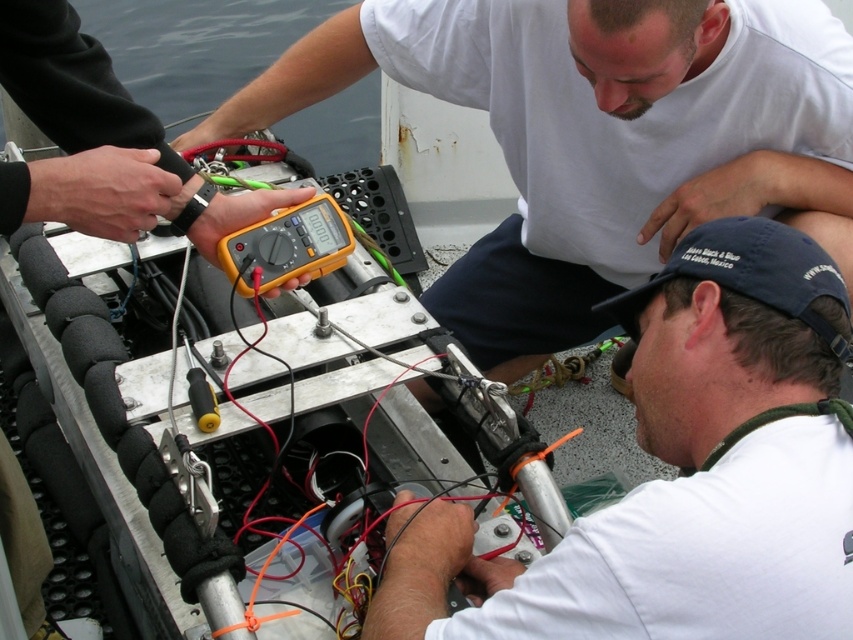
You are an electrician working on the metallic workbench near the water. You need to locate the yellow plastic multimeter at center quickly. According to the coordinates provided, where exactly should you look on the workbench?

The yellow plastic multimeter at center is located at coordinates point (596, 138) on the workbench.

In the scene shown: You are an electrician working on the metallic workbench. You need to reach the white matte cap at lower right to secure a connection. Is the yellow plastic multimeter at center blocking your direct path to it?

The white matte cap at lower right is behind the yellow plastic multimeter at center, so the multimeter is blocking the direct path to the cap. You will need to move the multimeter or go around it to access the cap.

You are an electrician working on the metallic workbench near the water. You need to measure voltage using the yellow plastic multimeter at center and the white matte cap at lower right. Which tool should you use for the measurement?

The yellow plastic multimeter at center should be used for measuring voltage because it is designed for such tasks, while the white matte cap at lower right is likely just a protective cover and not a measuring tool.